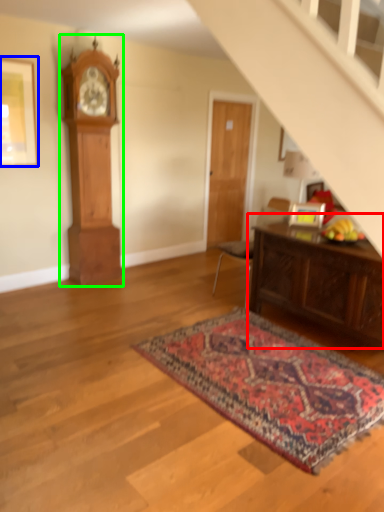
Question: Considering the real-world distances, which object is closest to table (highlighted by a red box)? picture frame (highlighted by a blue box) or clock (highlighted by a green box).

Choices:
 (A) picture frame
 (B) clock

Answer: (B)